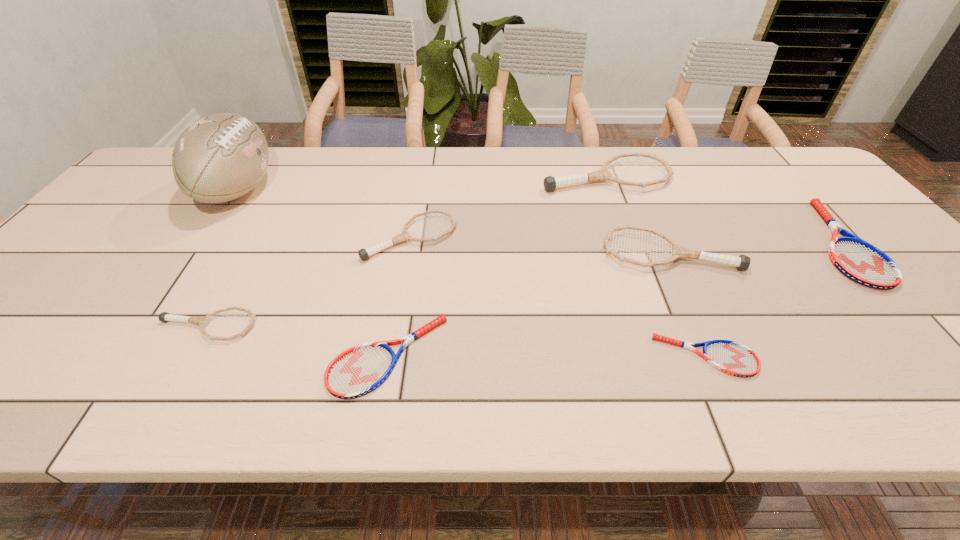
Identify the location of free spot located on the left of the rightmost tennis racket. (675, 243).

At what (x,y) coordinates should I click in order to perform the action: click on vacant space located on the right of the second shortest object. Please return your answer as a coordinate pair (x, y). The height and width of the screenshot is (540, 960). Looking at the image, I should click on (642, 356).

I want to click on vacant space located 0.300m on the back of the smallest blue tennis racket, so click(657, 243).

This screenshot has width=960, height=540. I want to click on football (American) at the far edge, so click(x=221, y=157).

Where is `tennis racket positioned at the far edge`? This screenshot has width=960, height=540. tennis racket positioned at the far edge is located at coordinates (550, 183).

Locate an element on the screen. The width and height of the screenshot is (960, 540). object at the right edge is located at coordinates (860, 261).

I want to click on vacant space at the far edge of the desktop, so click(344, 168).

The width and height of the screenshot is (960, 540). I want to click on free space at the near edge of the desktop, so [x=501, y=401].

The width and height of the screenshot is (960, 540). I want to click on vacant space at the left edge of the desktop, so click(144, 211).

In the image, there is a desktop. At what (x,y) coordinates should I click in order to perform the action: click on vacant space at the far right corner. Please return your answer as a coordinate pair (x, y). Looking at the image, I should click on (787, 179).